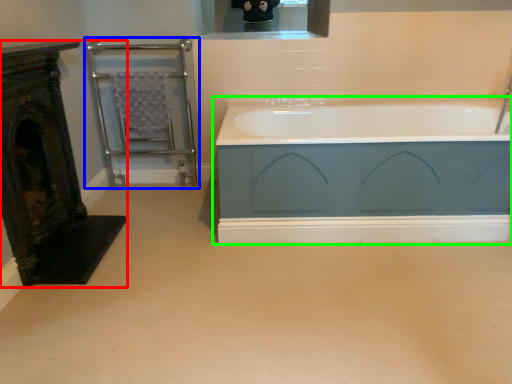
Question: Considering the real-world distances, which object is closest to fireplace (highlighted by a red box)? balustrade (highlighted by a blue box) or bathtub (highlighted by a green box).

Choices:
 (A) balustrade
 (B) bathtub

Answer: (A)